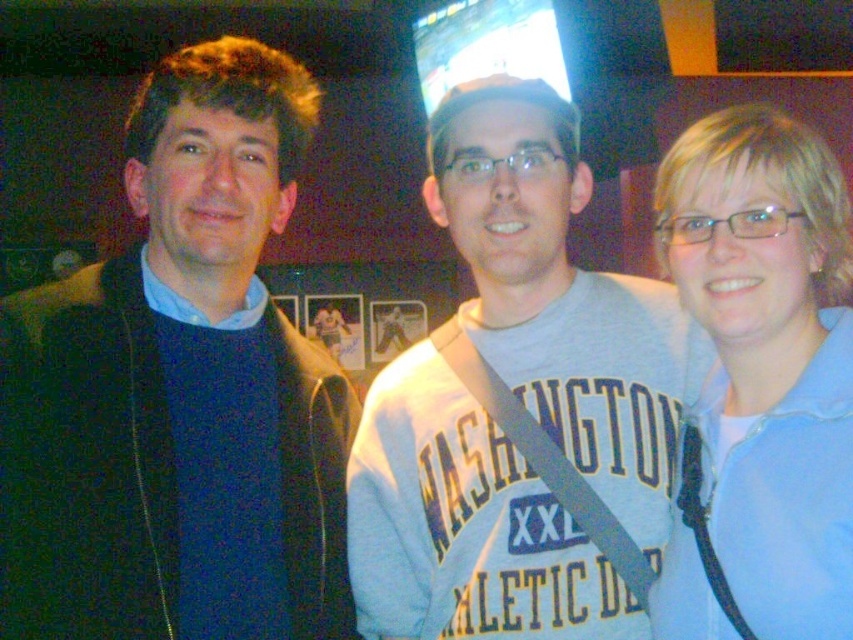
Question: Does blue matte sweater at left have a lesser width compared to gray cotton sweatshirt at center?

Choices:
 (A) yes
 (B) no

Answer: (A)

Question: Which object is the closest to the light blue fabric at right?

Choices:
 (A) blue matte sweater at left
 (B) gray cotton sweatshirt at center

Answer: (B)

Question: Can you confirm if blue matte sweater at left is positioned below gray cotton sweatshirt at center?

Choices:
 (A) yes
 (B) no

Answer: (B)

Question: Which of the following is the farthest from the observer?

Choices:
 (A) (512, 552)
 (B) (817, 413)
 (C) (207, 410)

Answer: (C)

Question: Is blue matte sweater at left in front of light blue fabric at right?

Choices:
 (A) no
 (B) yes

Answer: (A)

Question: Which of these objects is positioned closest to the light blue fabric at right?

Choices:
 (A) gray cotton sweatshirt at center
 (B) blue matte sweater at left

Answer: (A)